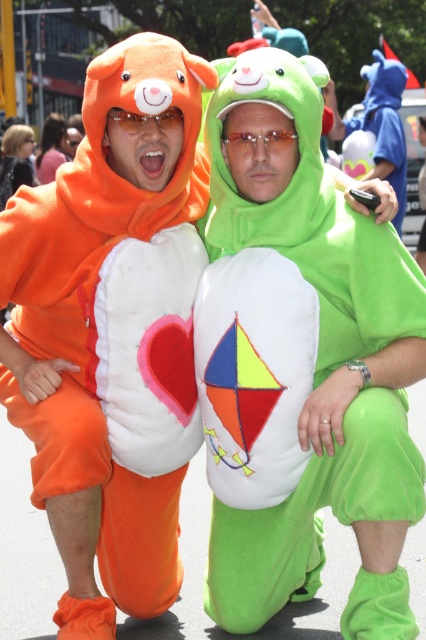
Question: Which object appears closest to the camera in this image?

Choices:
 (A) transparent plastic goggles at center
 (B) matte plastic goggles at upper center

Answer: (B)

Question: Is transparent plastic goggles at center further to camera compared to matte plastic goggles at upper center?

Choices:
 (A) no
 (B) yes

Answer: (B)

Question: Does transparent plastic goggles at center have a larger size compared to matte plastic goggles at upper center?

Choices:
 (A) yes
 (B) no

Answer: (A)

Question: In this image, where is transparent plastic goggles at center located relative to matte plastic goggles at upper center?

Choices:
 (A) below
 (B) above

Answer: (A)